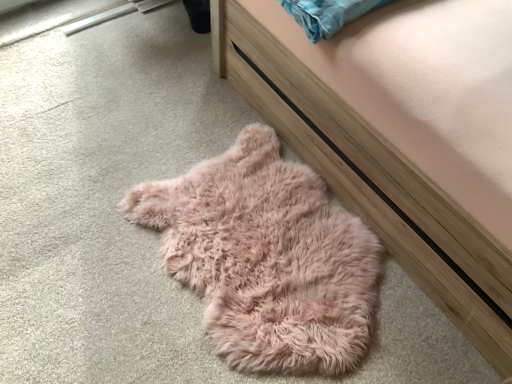
Locate an element on the screen. This screenshot has height=384, width=512. fuzzy pink rug at lower left is located at coordinates (375, 184).

What do you see at coordinates (375, 184) in the screenshot? I see `fuzzy pink rug at lower left` at bounding box center [375, 184].

In order to face fuzzy pink rug at lower left, should I rotate leftwards or rightwards?

You should look right and rotate roughly 1.005 degrees.

The height and width of the screenshot is (384, 512). Identify the location of fuzzy pink rug at lower left. (266, 258).

Image resolution: width=512 pixels, height=384 pixels. What do you see at coordinates (266, 258) in the screenshot?
I see `fuzzy pink rug at lower left` at bounding box center [266, 258].

Where is `fuzzy pink rug at lower left`? fuzzy pink rug at lower left is located at coordinates (375, 184).

Between fuzzy pink rug at lower left and fuzzy pink rug at lower left, which one appears on the left side from the viewer's perspective?

fuzzy pink rug at lower left is more to the left.

Is fuzzy pink rug at lower left positioned in front of fuzzy pink rug at lower left?

Yes.

Does point (369, 206) appear closer or farther from the camera than point (274, 260)?

Point (369, 206) is farther from the camera than point (274, 260).

From the image's perspective, would you say fuzzy pink rug at lower left is shown under fuzzy pink rug at lower left?

Incorrect, from the image's perspective, fuzzy pink rug at lower left is higher than fuzzy pink rug at lower left.

From a real-world perspective, which is physically above, fuzzy pink rug at lower left or fuzzy pink rug at lower left?

From a 3D spatial view, fuzzy pink rug at lower left is above.

Consider the image. Considering the relative sizes of fuzzy pink rug at lower left and fuzzy pink rug at lower left in the image provided, is fuzzy pink rug at lower left thinner than fuzzy pink rug at lower left?

In fact, fuzzy pink rug at lower left might be wider than fuzzy pink rug at lower left.

Between fuzzy pink rug at lower left and fuzzy pink rug at lower left, which one has less height?

fuzzy pink rug at lower left is shorter.

Considering the relative sizes of fuzzy pink rug at lower left and fuzzy pink rug at lower left in the image provided, is fuzzy pink rug at lower left smaller than fuzzy pink rug at lower left?

No, fuzzy pink rug at lower left is not smaller than fuzzy pink rug at lower left.

Is fuzzy pink rug at lower left spatially inside fuzzy pink rug at lower left, or outside of it?

fuzzy pink rug at lower left is spatially situated outside fuzzy pink rug at lower left.

Is fuzzy pink rug at lower left not near fuzzy pink rug at lower left?

They are positioned close to each other.

Is fuzzy pink rug at lower left positioned with its back to fuzzy pink rug at lower left?

No, fuzzy pink rug at lower left is not at the back of fuzzy pink rug at lower left.

Can you tell me how much fuzzy pink rug at lower left and fuzzy pink rug at lower left differ in facing direction?

The angle between the facing direction of fuzzy pink rug at lower left and the facing direction of fuzzy pink rug at lower left is 0.463 degrees.

Where is `sleeping bag that is behind the fuzzy pink rug at lower left`? sleeping bag that is behind the fuzzy pink rug at lower left is located at coordinates (266, 258).

Considering the relative positions of fuzzy pink rug at lower left and fuzzy pink rug at lower left in the image provided, is fuzzy pink rug at lower left to the left of fuzzy pink rug at lower left from the viewer's perspective?

Yes.

Which object is further away from the camera, fuzzy pink rug at lower left or fuzzy pink rug at lower left?

fuzzy pink rug at lower left is behind.

Is point (284, 160) positioned behind point (372, 205)?

Yes, point (284, 160) is behind point (372, 205).

Looking at this image, from the image's perspective, is fuzzy pink rug at lower left on fuzzy pink rug at lower left?

Incorrect, from the image's perspective, fuzzy pink rug at lower left is lower than fuzzy pink rug at lower left.

In the scene shown: From a real-world perspective, is fuzzy pink rug at lower left below fuzzy pink rug at lower left?

Indeed, from a real-world perspective, fuzzy pink rug at lower left is positioned beneath fuzzy pink rug at lower left.

Between fuzzy pink rug at lower left and fuzzy pink rug at lower left, which one has smaller width?

With smaller width is fuzzy pink rug at lower left.

Who is taller, fuzzy pink rug at lower left or fuzzy pink rug at lower left?

fuzzy pink rug at lower left.

Can you confirm if fuzzy pink rug at lower left is bigger than fuzzy pink rug at lower left?

No, fuzzy pink rug at lower left is not bigger than fuzzy pink rug at lower left.

Is fuzzy pink rug at lower left outside of fuzzy pink rug at lower left?

Yes.

Looking at this image, are fuzzy pink rug at lower left and fuzzy pink rug at lower left making contact?

fuzzy pink rug at lower left and fuzzy pink rug at lower left are not in contact.

Could you tell me if fuzzy pink rug at lower left is turned towards fuzzy pink rug at lower left?

No, fuzzy pink rug at lower left is not aimed at fuzzy pink rug at lower left.

How many degrees apart are the facing directions of fuzzy pink rug at lower left and fuzzy pink rug at lower left?

The facing directions of fuzzy pink rug at lower left and fuzzy pink rug at lower left are 0.463 degrees apart.

Where is `furniture lying above the fuzzy pink rug at lower left (from the image's perspective)`? This screenshot has width=512, height=384. furniture lying above the fuzzy pink rug at lower left (from the image's perspective) is located at coordinates (375, 184).

Locate an element on the screen. Image resolution: width=512 pixels, height=384 pixels. sleeping bag that is below the fuzzy pink rug at lower left (from the image's perspective) is located at coordinates coord(266,258).

Identify the location of furniture in front of the fuzzy pink rug at lower left. (375, 184).